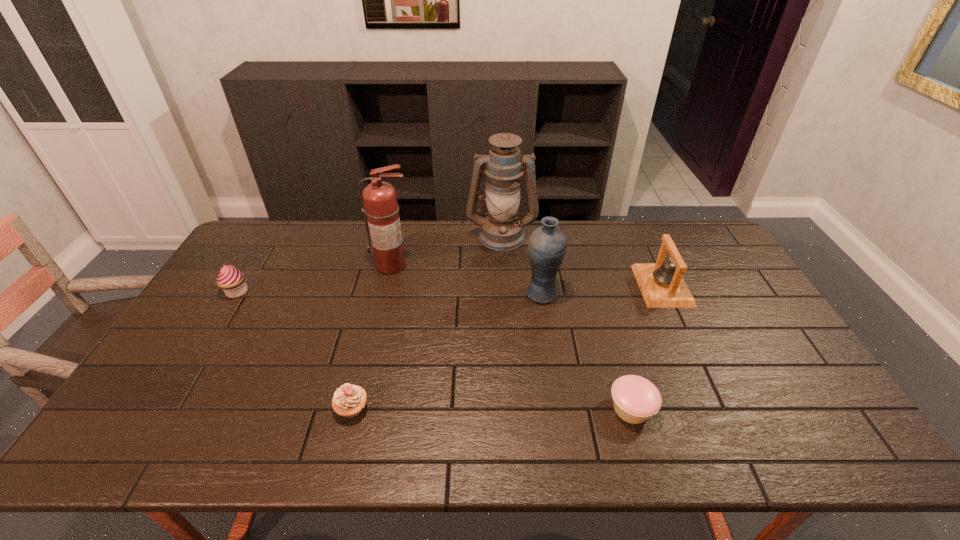
Where is `empty space that is in between the third tallest object and the second shortest object`? The image size is (960, 540). empty space that is in between the third tallest object and the second shortest object is located at coordinates (446, 351).

The height and width of the screenshot is (540, 960). Find the location of `vacant area that lies between the oil lamp and the sixth tallest object`. vacant area that lies between the oil lamp and the sixth tallest object is located at coordinates coord(427,322).

Where is `unoccupied area between the second tallest cupcake and the fire extinguisher`? Image resolution: width=960 pixels, height=540 pixels. unoccupied area between the second tallest cupcake and the fire extinguisher is located at coordinates (372, 337).

At what (x,y) coordinates should I click in order to perform the action: click on free space between the farthest object and the leftmost cupcake. Please return your answer as a coordinate pair (x, y). Image resolution: width=960 pixels, height=540 pixels. Looking at the image, I should click on (370, 264).

Find the location of `free area in between the vase and the farthest object`. free area in between the vase and the farthest object is located at coordinates (521, 265).

The width and height of the screenshot is (960, 540). What are the coordinates of `vacant area between the bell and the oil lamp` in the screenshot? It's located at (582, 260).

Identify the location of the closest object to the vase. (501, 230).

The height and width of the screenshot is (540, 960). Identify the location of the fifth closest object to the vase. (348, 401).

Image resolution: width=960 pixels, height=540 pixels. I want to click on cupcake that is the second closest one to the second shortest object, so click(x=635, y=399).

Point out which cupcake is positioned as the nearest to the leftmost object. Please provide its 2D coordinates. Your answer should be formatted as a tuple, i.e. [(x, y)], where the tuple contains the x and y coordinates of a point satisfying the conditions above.

[(348, 401)]